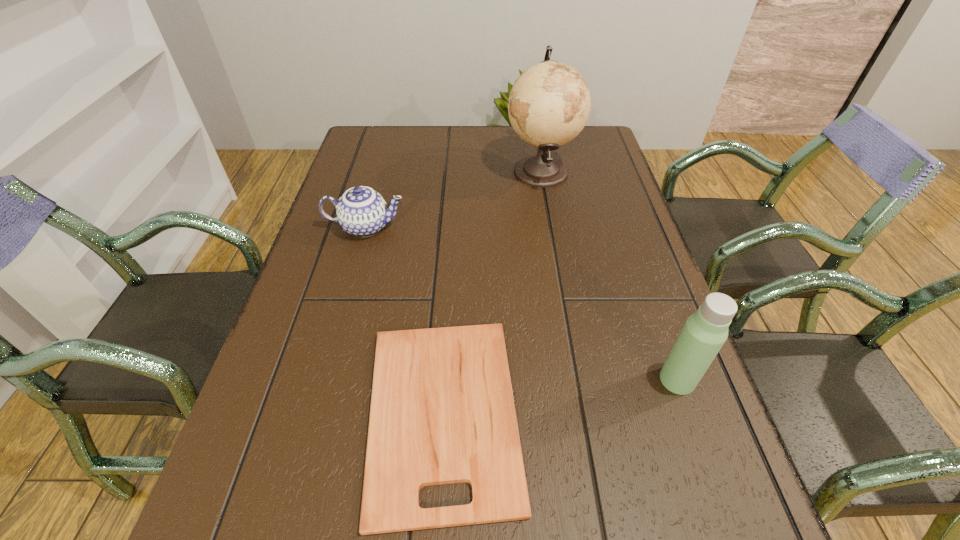
Locate an element on the screen. The width and height of the screenshot is (960, 540). vacant space at the right edge of the desktop is located at coordinates (608, 315).

Locate an element on the screen. free space between the second tallest object and the chopping board is located at coordinates (561, 396).

At what (x,y) coordinates should I click in order to perform the action: click on unoccupied position between the rightmost object and the second farthest object. Please return your answer as a coordinate pair (x, y). This screenshot has width=960, height=540. Looking at the image, I should click on (521, 303).

This screenshot has width=960, height=540. I want to click on free space between the chopping board and the third shortest object, so [561, 396].

This screenshot has width=960, height=540. In order to click on free space between the second farthest object and the globe in this screenshot , I will do `click(453, 199)`.

Image resolution: width=960 pixels, height=540 pixels. Identify the location of free space between the thermos bottle and the farthest object. (609, 275).

Locate an element on the screen. free space between the chopping board and the chinaware is located at coordinates (404, 320).

Where is `vacant space in between the chinaware and the chopping board`? The image size is (960, 540). vacant space in between the chinaware and the chopping board is located at coordinates (404, 320).

The width and height of the screenshot is (960, 540). In order to click on free space between the thermos bottle and the third tallest object in this screenshot , I will do `click(521, 303)`.

Where is `unoccupied area between the farthest object and the rightmost object`? This screenshot has height=540, width=960. unoccupied area between the farthest object and the rightmost object is located at coordinates point(609,275).